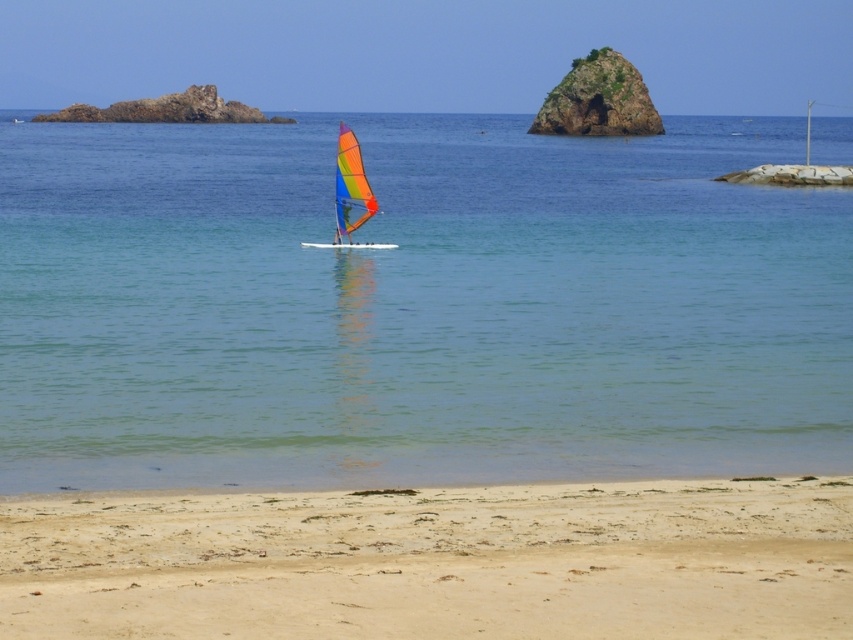
Question: Which of the following is the closest to the observer?

Choices:
 (A) (172, 584)
 (B) (762, 424)

Answer: (A)

Question: Which of the following is the farthest from the observer?

Choices:
 (A) beige sandy beach at lower center
 (B) clear blue water at center
 (C) rainbow fabric sailboat at center

Answer: (C)

Question: Does green mossy rock at upper center appear under rainbow fabric sailboat at center?

Choices:
 (A) yes
 (B) no

Answer: (B)

Question: Can you confirm if beige sandy beach at lower center is bigger than rainbow fabric sailboat at center?

Choices:
 (A) no
 (B) yes

Answer: (A)

Question: Is beige sandy beach at lower center positioned before green mossy rock at upper center?

Choices:
 (A) yes
 (B) no

Answer: (A)

Question: Based on their relative distances, which object is farther from the beige sandy beach at lower center?

Choices:
 (A) rainbow fabric sailboat at center
 (B) clear blue water at center

Answer: (B)